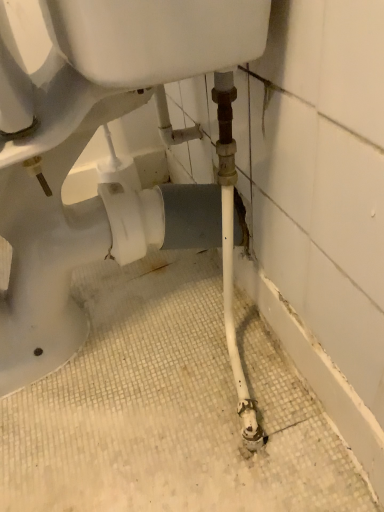
Image resolution: width=384 pixels, height=512 pixels. What do you see at coordinates (86, 144) in the screenshot?
I see `white plastic pipe at center` at bounding box center [86, 144].

Locate an element on the screen. The image size is (384, 512). white plastic pipe at center is located at coordinates pos(86,144).

Locate an element on the screen. white plastic pipe at center is located at coordinates 86,144.